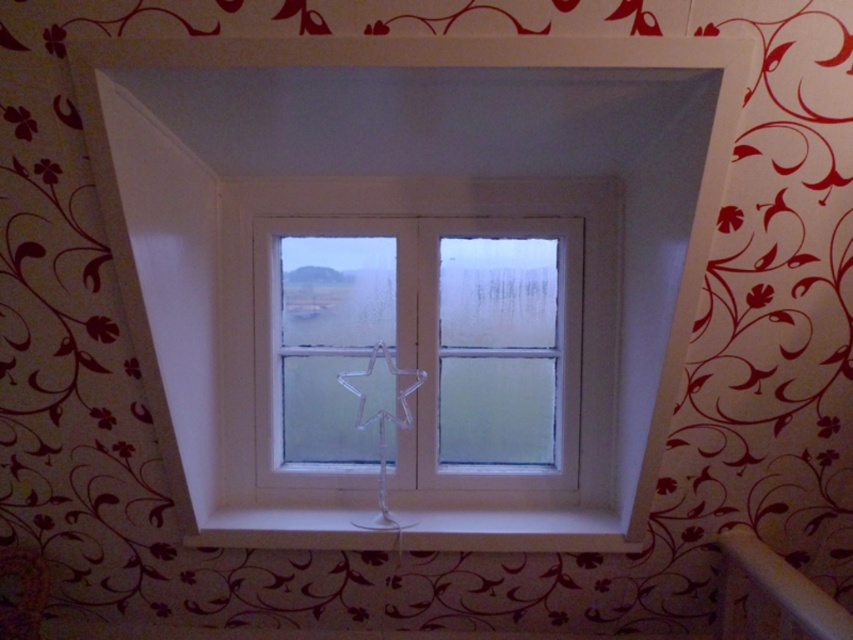
You are organizing a small plant collection. You have a small potted plant that is 15 cm wide. You want to place it on the white glossy shelf at lower center. Considering the size of the white plastic window frame at center, will the plant fit on the shelf?

The white plastic window frame at center is larger than the white glossy shelf at lower center, but the plant is only 15 cm wide. Since the shelf is smaller than the window frame, but the plant is small, it should fit on the shelf as long as the shelf is wide enough to accommodate the 15 cm width.

You are standing in the room looking at the window. There are two points marked on the window frame. Which point is closer to you, point (170, 100) or point (448, 508)?

Point (170, 100) is closer to you than point (448, 508).